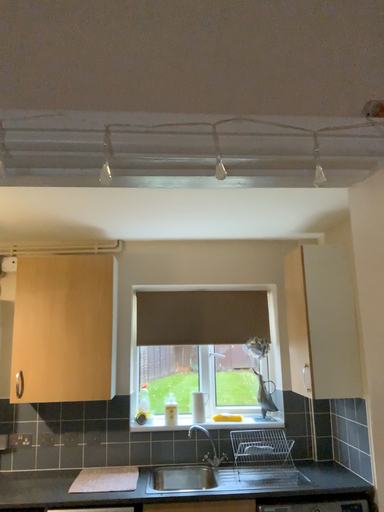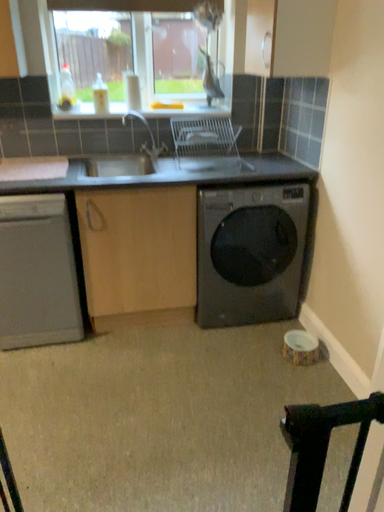
Question: Which way did the camera rotate in the video?

Choices:
 (A) rotated downward
 (B) rotated upward

Answer: (A)